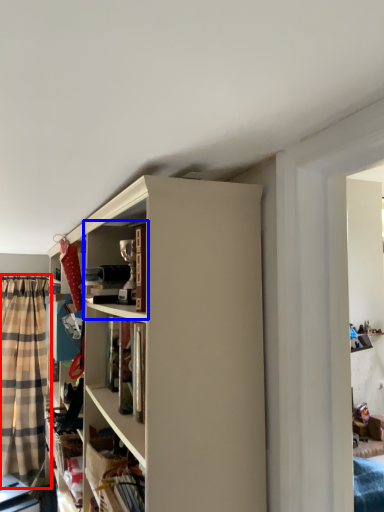
Question: Among these objects, which one is nearest to the camera, curtain (highlighted by a red box) or cabinet (highlighted by a blue box)?

Choices:
 (A) curtain
 (B) cabinet

Answer: (B)